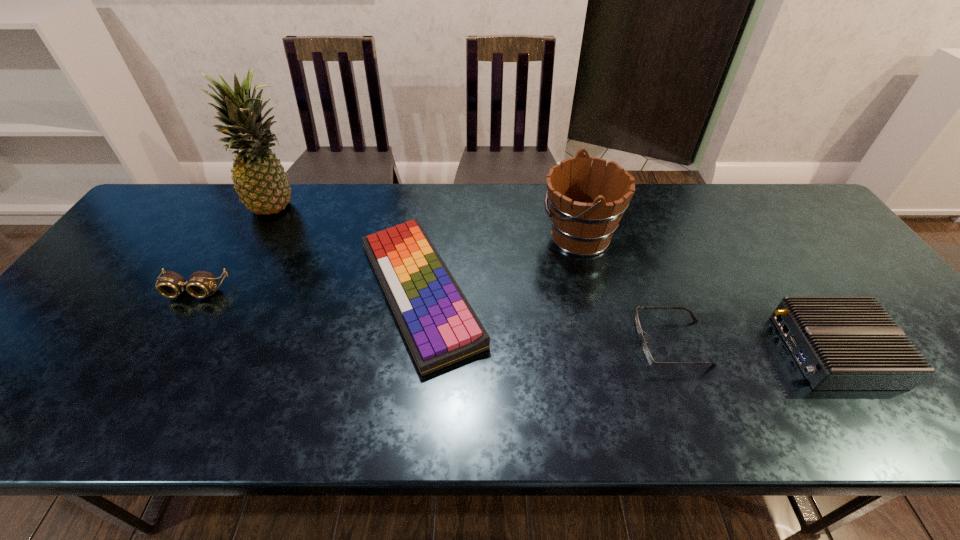
Identify the location of free spot located with the handle on the wine bucket. This screenshot has width=960, height=540. (498, 237).

In order to click on vacant space located with the handle on the wine bucket in this screenshot , I will do `click(492, 237)`.

Where is `free region located 0.220m on the back panel of the rightmost object`? free region located 0.220m on the back panel of the rightmost object is located at coordinates (686, 351).

Where is `vacant space located on the back panel of the rightmost object`? The height and width of the screenshot is (540, 960). vacant space located on the back panel of the rightmost object is located at coordinates (756, 351).

Find the location of `blank space located on the back panel of the rightmost object`. blank space located on the back panel of the rightmost object is located at coordinates (690, 351).

Locate an element on the screen. This screenshot has width=960, height=540. free region located through the lenses of the fourth tallest object is located at coordinates (129, 399).

Identify the location of vacant region located on the left of the third object from left to right. This screenshot has width=960, height=540. (285, 292).

The height and width of the screenshot is (540, 960). In order to click on free spot located 0.380m on the front-facing side of the spectacles in this screenshot , I will do `click(474, 343)`.

Find the location of a particular element. Image resolution: width=960 pixels, height=540 pixels. vacant space situated 0.200m on the front-facing side of the spectacles is located at coordinates (552, 343).

You are a GUI agent. You are given a task and a screenshot of the screen. Output one action in this format:
    pyautogui.click(x=<x>, y=<y>)
    Task: Click on the free region located 0.310m on the front-facing side of the spectacles
    
    Given the screenshot: What is the action you would take?
    pyautogui.click(x=504, y=343)